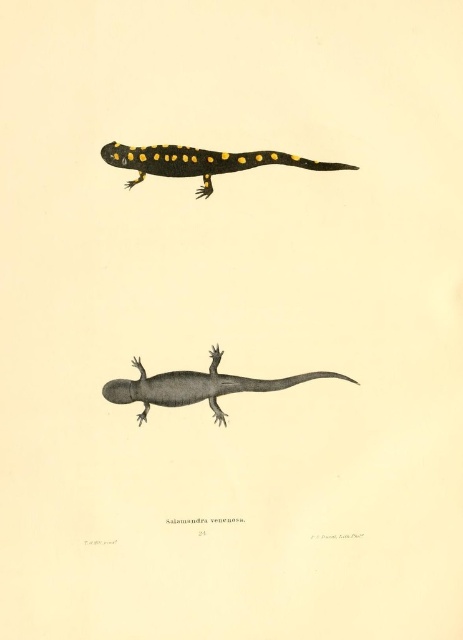
You are an animal researcher observing the two salamanders in the image. Which one is closer to you, the gray matte salamander at center or the black glossy salamander at upper center?

The gray matte salamander at center is closer to you because the black glossy salamander at upper center is positioned behind it.

You are an animal researcher examining the image of the gray matte salamander at center. You notice a point labeled at coordinates (196, 387). Where exactly is this point located on the gray matte salamander at center?

The point labeled at coordinates (196, 387) is located on the gray matte salamander at center.

Where is the gray matte salamander at center located in the image?

The gray matte salamander at center is located at point (196, 387) in the image.